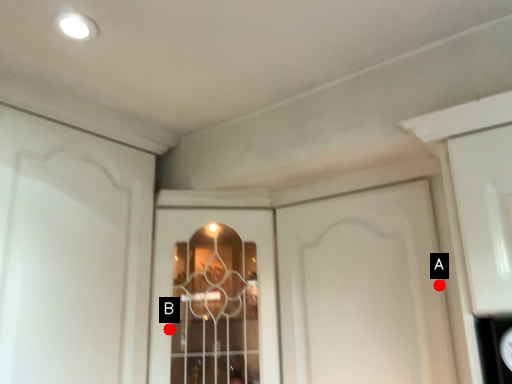
Question: Two points are circled on the image, labeled by A and B beside each circle. Among these points, which one is farthest from the camera?

Choices:
 (A) A is further
 (B) B is further

Answer: (B)